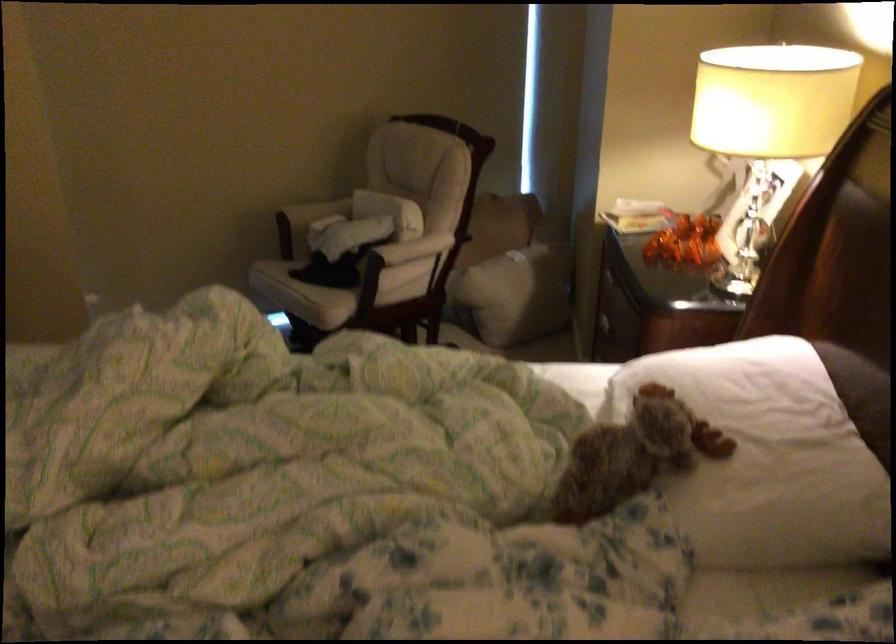
The height and width of the screenshot is (644, 896). In order to click on wooden chair armrest in this screenshot , I will do `click(415, 250)`.